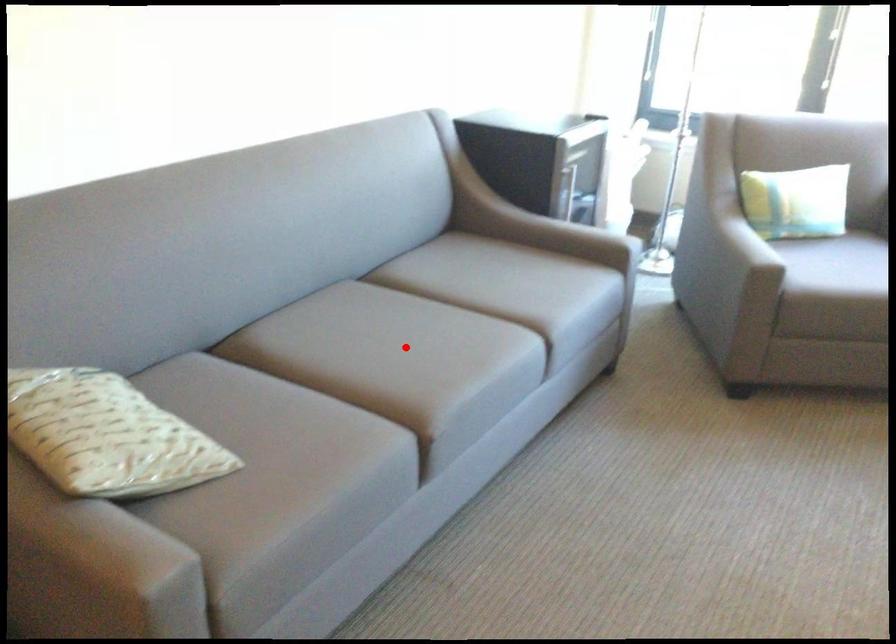
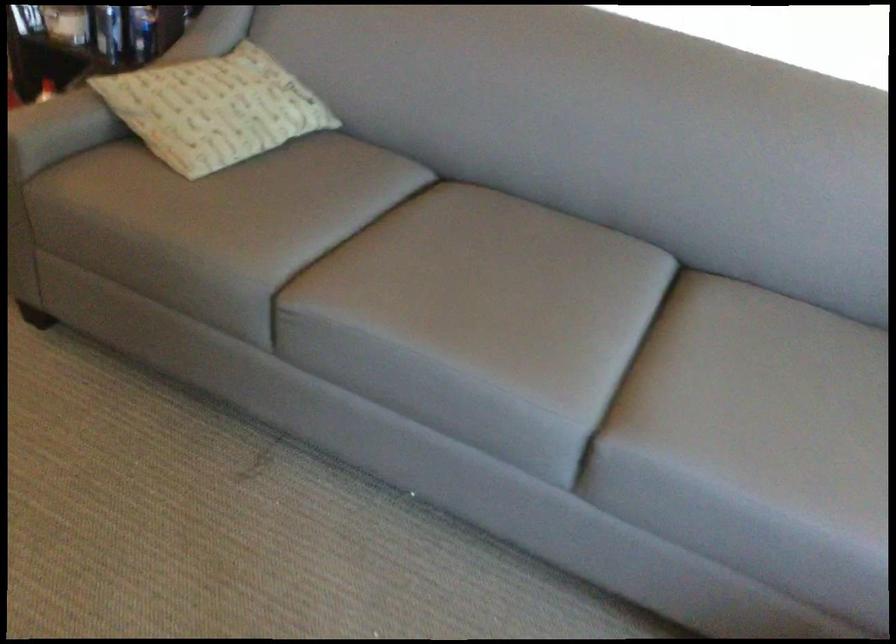
In the second image, find the point that corresponds to the highlighted location in the first image.

(479, 290)